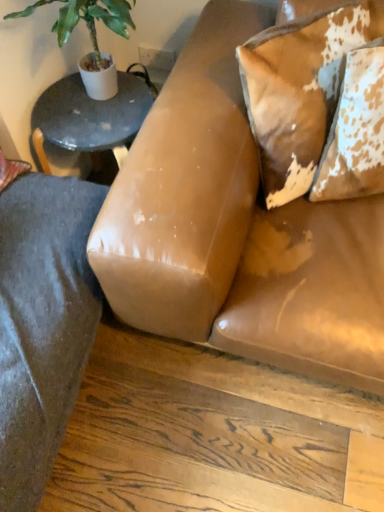
Question: Does speckled leather pillow at upper right, marked as the 1th pillow in a left-to-right arrangement, have a greater width compared to green leafy plant at upper left?

Choices:
 (A) yes
 (B) no

Answer: (B)

Question: From the image's perspective, does speckled leather pillow at upper right, marked as the 1th pillow in a left-to-right arrangement, appear higher than green leafy plant at upper left?

Choices:
 (A) yes
 (B) no

Answer: (B)

Question: Does speckled leather pillow at upper right, the 2th pillow viewed from the right, lie in front of green leafy plant at upper left?

Choices:
 (A) yes
 (B) no

Answer: (A)

Question: Is speckled leather pillow at upper right, the 2th pillow viewed from the right, taller than green leafy plant at upper left?

Choices:
 (A) yes
 (B) no

Answer: (B)

Question: Considering the relative sizes of speckled leather pillow at upper right, marked as the 1th pillow in a left-to-right arrangement, and green leafy plant at upper left in the image provided, is speckled leather pillow at upper right, marked as the 1th pillow in a left-to-right arrangement, thinner than green leafy plant at upper left?

Choices:
 (A) no
 (B) yes

Answer: (B)

Question: From the image's perspective, is green leafy plant at upper left above or below brown cowhide pillow at upper right, arranged as the second pillow when viewed from the left?

Choices:
 (A) above
 (B) below

Answer: (A)

Question: Looking at the image, does green leafy plant at upper left seem bigger or smaller compared to brown cowhide pillow at upper right, arranged as the second pillow when viewed from the left?

Choices:
 (A) big
 (B) small

Answer: (A)

Question: From their relative heights in the image, would you say green leafy plant at upper left is taller or shorter than brown cowhide pillow at upper right, arranged as the second pillow when viewed from the left?

Choices:
 (A) short
 (B) tall

Answer: (B)

Question: From a real-world perspective, is green leafy plant at upper left positioned above or below brown cowhide pillow at upper right, placed as the 1th pillow when sorted from right to left?

Choices:
 (A) above
 (B) below

Answer: (A)

Question: In terms of size, does speckled leather pillow at upper right, the 2th pillow viewed from the right, appear bigger or smaller than leather couch at center?

Choices:
 (A) small
 (B) big

Answer: (A)

Question: Does point (314, 32) appear closer or farther from the camera than point (292, 286)?

Choices:
 (A) closer
 (B) farther

Answer: (B)

Question: Which is correct: speckled leather pillow at upper right, marked as the 1th pillow in a left-to-right arrangement, is inside leather couch at center, or outside of it?

Choices:
 (A) outside
 (B) inside

Answer: (B)

Question: Is speckled leather pillow at upper right, marked as the 1th pillow in a left-to-right arrangement, taller or shorter than leather couch at center?

Choices:
 (A) tall
 (B) short

Answer: (B)

Question: From a real-world perspective, is speckled leather pillow at upper right, the 2th pillow viewed from the right, physically located above or below brown cowhide pillow at upper right, arranged as the second pillow when viewed from the left?

Choices:
 (A) above
 (B) below

Answer: (B)

Question: Would you say speckled leather pillow at upper right, marked as the 1th pillow in a left-to-right arrangement, is inside or outside brown cowhide pillow at upper right, placed as the 1th pillow when sorted from right to left?

Choices:
 (A) inside
 (B) outside

Answer: (B)